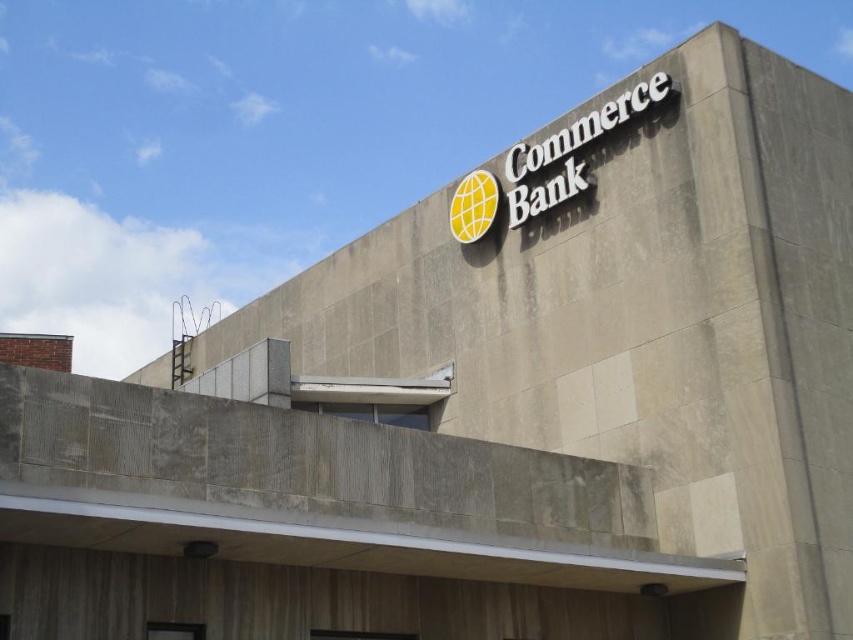
Question: Which object appears closest to the camera in this image?

Choices:
 (A) white metallic sign at upper center
 (B) yellow matte globe at center

Answer: (A)

Question: Among these points, which one is farthest from the camera?

Choices:
 (A) (489, 218)
 (B) (538, 204)

Answer: (A)

Question: From the image, what is the correct spatial relationship of white metallic sign at upper center in relation to yellow matte globe at center?

Choices:
 (A) right
 (B) left

Answer: (A)

Question: Does white metallic sign at upper center have a lesser width compared to yellow matte globe at center?

Choices:
 (A) yes
 (B) no

Answer: (B)

Question: Can you confirm if white metallic sign at upper center is positioned above yellow matte globe at center?

Choices:
 (A) yes
 (B) no

Answer: (A)